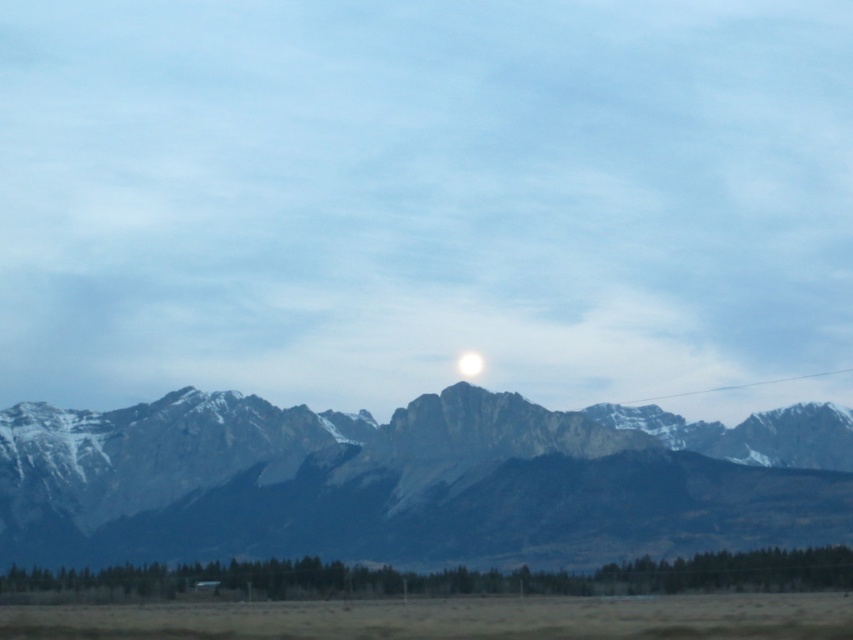
Question: In this image, where is gray rocky mountain range at center located relative to white glossy moon at center?

Choices:
 (A) above
 (B) below

Answer: (B)

Question: Is gray rocky mountain range at center behind brown grassland at lower center?

Choices:
 (A) yes
 (B) no

Answer: (A)

Question: Considering the real-world distances, which object is closest to the brown grassland at lower center?

Choices:
 (A) white glossy moon at center
 (B) gray rocky mountain range at center
 (C) clear plastic wire at upper right

Answer: (B)

Question: Which point is farther to the camera?

Choices:
 (A) clear plastic wire at upper right
 (B) white glossy moon at center
 (C) gray rocky mountain range at center

Answer: (A)

Question: Which point is closer to the camera?

Choices:
 (A) brown grassland at lower center
 (B) white glossy moon at center
 (C) clear plastic wire at upper right
 (D) gray rocky mountain range at center

Answer: (A)

Question: Is gray rocky mountain range at center positioned behind clear plastic wire at upper right?

Choices:
 (A) yes
 (B) no

Answer: (B)